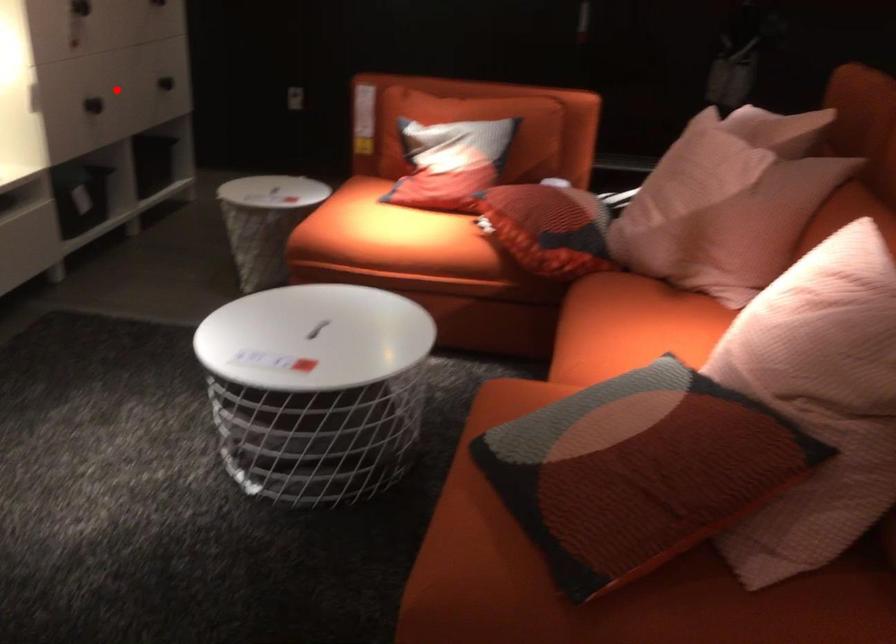
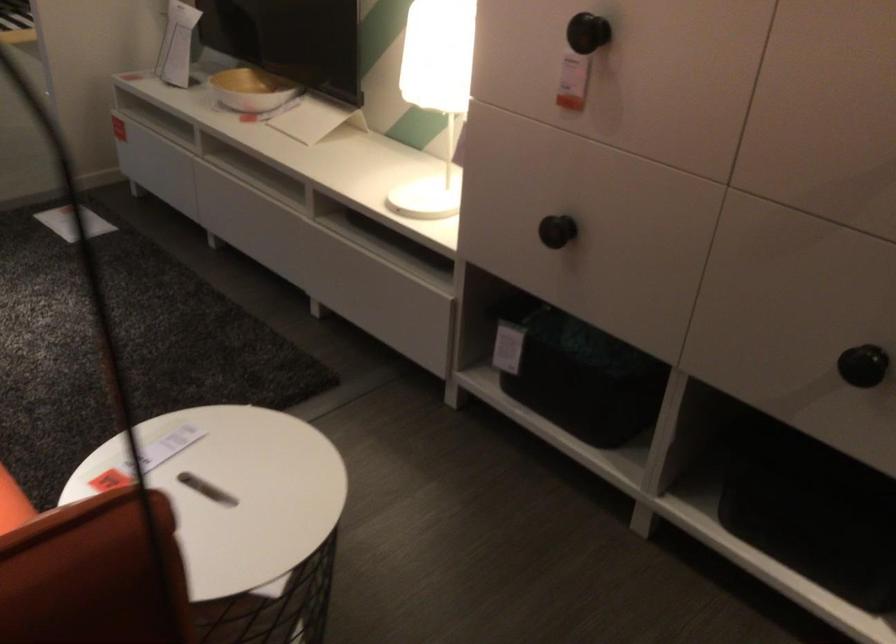
Question: I am providing you with two images of the same scene from different viewpoints. Image1 has a red point marked. In image2, the corresponding 3D location appears at what relative position? Reply with the corresponding letter.

Choices:
 (A) Closer
 (B) Farther

Answer: (A)